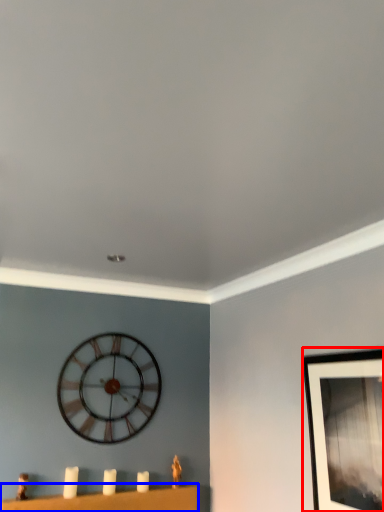
Question: Among these objects, which one is nearest to the camera, picture frame (highlighted by a red box) or furniture (highlighted by a blue box)?

Choices:
 (A) picture frame
 (B) furniture

Answer: (A)